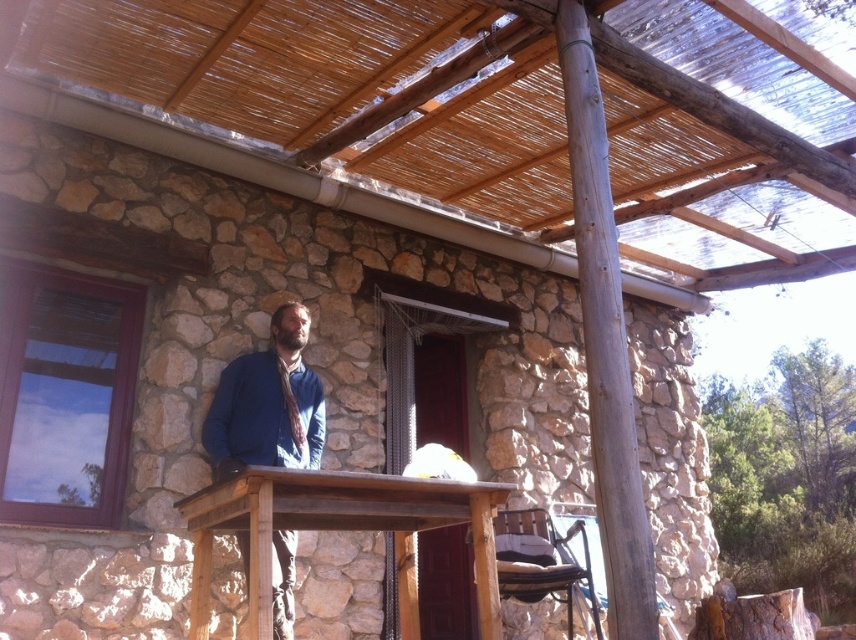
Question: Observing the image, what is the correct spatial positioning of gray wood pole at upper center in reference to rustic wood table at center?

Choices:
 (A) right
 (B) left

Answer: (A)

Question: Which point is farther to the camera?

Choices:
 (A) (403, 502)
 (B) (271, 596)
 (C) (587, 381)

Answer: (A)

Question: Can you confirm if natural thatched roof at upper center is positioned below gray wood pole at upper center?

Choices:
 (A) no
 (B) yes

Answer: (A)

Question: Which point appears closest to the camera in this image?

Choices:
 (A) (610, 346)
 (B) (675, 186)

Answer: (A)

Question: Does gray wood pole at upper center appear over rustic wood table at center?

Choices:
 (A) no
 (B) yes

Answer: (B)

Question: Which point is farther from the camera taking this photo?

Choices:
 (A) (292, 536)
 (B) (482, 564)
 (C) (635, 624)

Answer: (A)